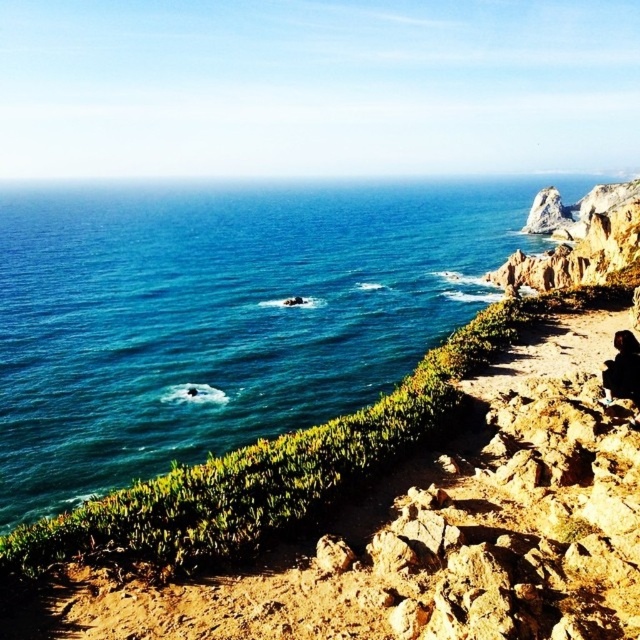
Can you confirm if dark hair at lower right is positioned to the left of brown textured rock at center?

No, dark hair at lower right is not to the left of brown textured rock at center.

Which is above, dark hair at lower right or brown textured rock at center?

brown textured rock at center is above.

Who is more forward, [628,371] or [291,305]?

Point [628,371]

Identify the location of dark hair at lower right. (621, 369).

Which is below, blue water at upper left or brown textured rock at center?

Positioned lower is brown textured rock at center.

Is point (116, 422) behind point (288, 301)?

No.

In order to click on blue water at upper left in this screenshot , I will do `click(221, 314)`.

Find the location of a particular element. The image size is (640, 640). blue water at upper left is located at coordinates (221, 314).

How much distance is there between blue water at upper left and dark hair at lower right?

171.28 meters

Between point (60, 467) and point (625, 385), which one is positioned behind?

Point (60, 467)

Locate an element on the screen. The image size is (640, 640). blue water at upper left is located at coordinates click(221, 314).